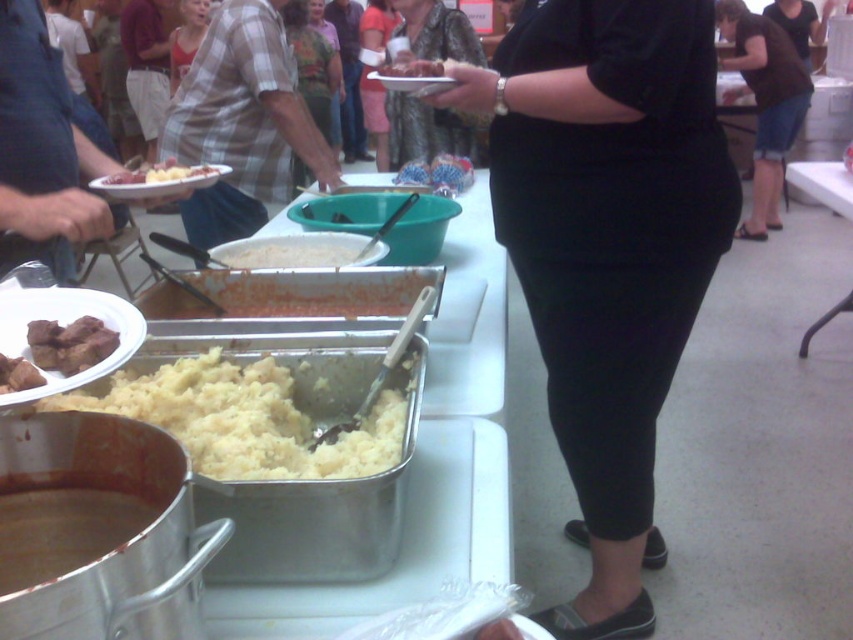
Question: Which point appears closest to the camera in this image?

Choices:
 (A) (18, 388)
 (B) (186, 51)
 (C) (351, 253)

Answer: (A)

Question: Is black matte pants at center to the left of matte black shirt at center from the viewer's perspective?

Choices:
 (A) yes
 (B) no

Answer: (B)

Question: Is the position of yellow mashed potato at center more distant than that of matte white shirt at upper left?

Choices:
 (A) yes
 (B) no

Answer: (B)

Question: In this image, where is white creamy mashed potatoes at center located relative to brown matte meat at center?

Choices:
 (A) above
 (B) below

Answer: (A)

Question: Which point is closer to the camera?

Choices:
 (A) yellow mashed potato at center
 (B) brown cotton shirt at center
 (C) matte white shirt at upper left

Answer: (A)

Question: Which point appears farthest from the camera in this image?

Choices:
 (A) (350, 253)
 (B) (762, 88)

Answer: (B)